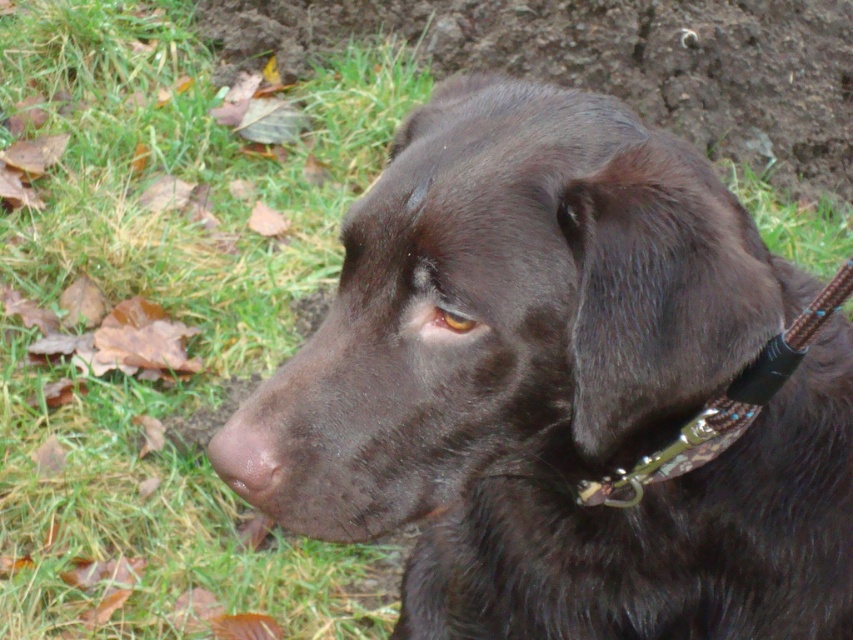
You are a dog owner trying to locate your dog in a park. You see a green grass at lower left and a brown smooth nose at center. Which object is closer to you?

The brown smooth nose at center is behind the green grass at lower left, so the green grass at lower left is closer to you.

You are a dog owner trying to decide where to place your chocolate Labrador Retriever for a photo. The dog has a brown smooth nose at center and is standing on green grass at lower left. Which area would allow the dog to have more space to move around without overlapping the grass?

The green grass at lower left has a larger width than the brown smooth nose at center, so placing the dog on the green grass at lower left would provide more space for movement without overlapping the grass.